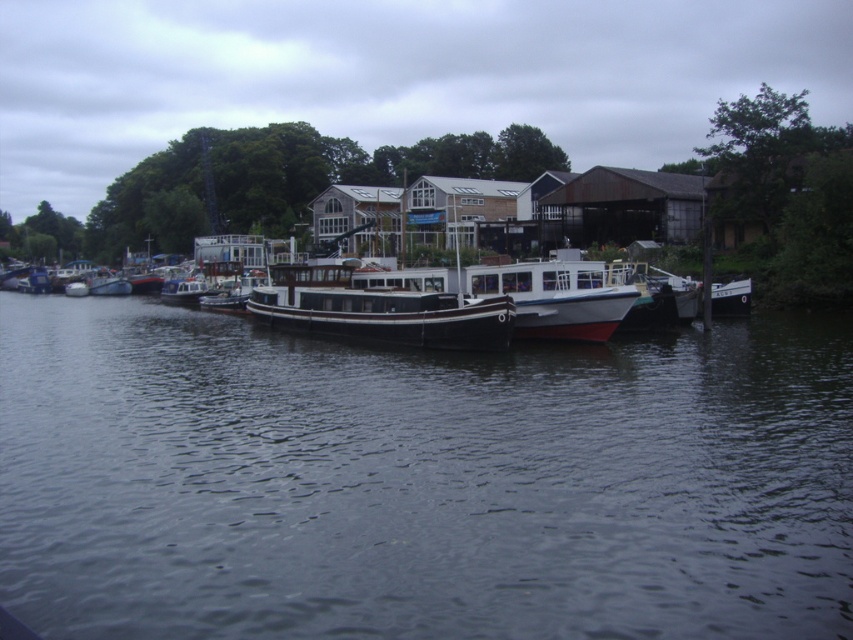
This screenshot has height=640, width=853. What do you see at coordinates (378, 310) in the screenshot? I see `black matte houseboat at center` at bounding box center [378, 310].

Between black matte houseboat at center and white matte boat at center, which one has less height?

black matte houseboat at center

I want to click on black matte houseboat at center, so click(x=378, y=310).

Between dark water at center and black matte houseboat at center, which one appears on the right side from the viewer's perspective?

dark water at center

Does dark water at center have a greater width compared to black matte houseboat at center?

Correct, the width of dark water at center exceeds that of black matte houseboat at center.

Who is more distant from viewer, (477, 394) or (440, 301)?

The point (440, 301) is more distant.

Locate an element on the screen. dark water at center is located at coordinates (419, 481).

Is point (759, 486) in front of point (515, 328)?

That is True.

Measure the distance between dark water at center and camera.

22.85 feet

Locate an element on the screen. The image size is (853, 640). dark water at center is located at coordinates (419, 481).